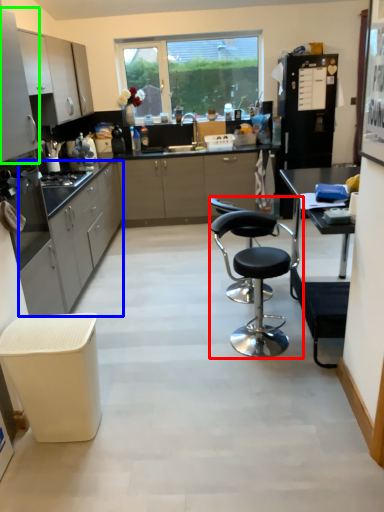
Question: Based on their relative distances, which object is nearer to chair (highlighted by a red box)? Choose from cabinetry (highlighted by a blue box) and cabinetry (highlighted by a green box).

Choices:
 (A) cabinetry
 (B) cabinetry

Answer: (A)